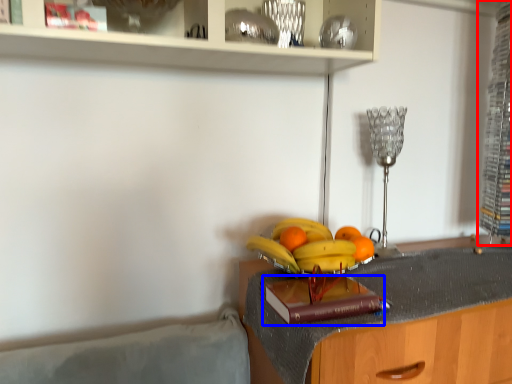
Question: Which point is closer to the camera, cabinet (highlighted by a red box) or book (highlighted by a blue box)?

Choices:
 (A) cabinet
 (B) book

Answer: (B)